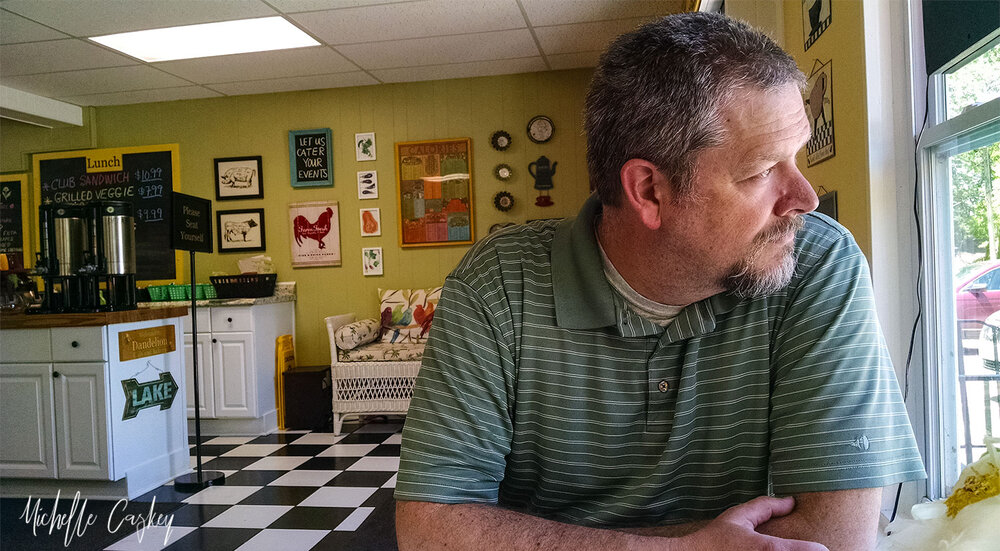
I want to click on sign saying "please seat yourself", so click(x=201, y=232).